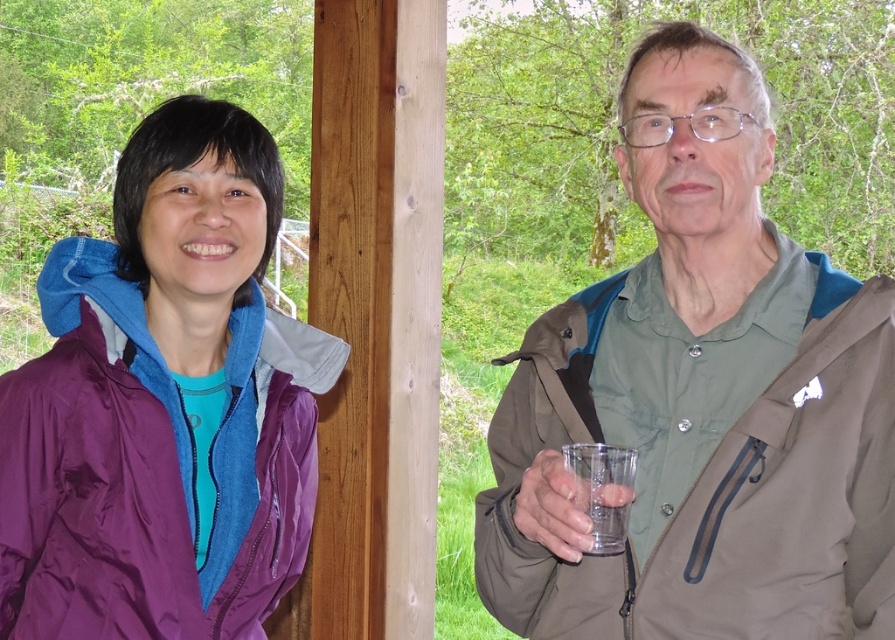
Question: Which point appears farthest from the camera in this image?

Choices:
 (A) (299, 461)
 (B) (615, 419)
 (C) (631, 458)

Answer: (A)

Question: Which is farther from the matte green shirt at center?

Choices:
 (A) transparent plastic cup at right
 (B) purple nylon jacket at left

Answer: (B)

Question: Does matte green shirt at center appear under purple nylon jacket at left?

Choices:
 (A) no
 (B) yes

Answer: (A)

Question: Can you confirm if purple nylon jacket at left is positioned above transparent plastic cup at right?

Choices:
 (A) no
 (B) yes

Answer: (A)

Question: Is purple nylon jacket at left to the left of transparent plastic cup at right from the viewer's perspective?

Choices:
 (A) yes
 (B) no

Answer: (A)

Question: Which object is positioned closest to the matte green shirt at center?

Choices:
 (A) purple nylon jacket at left
 (B) transparent plastic cup at right

Answer: (B)